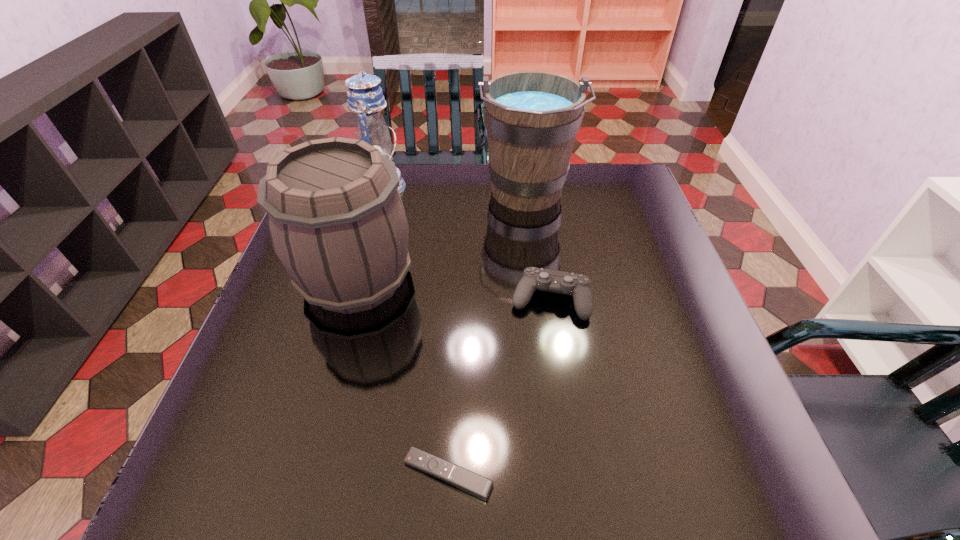
I want to click on free location at the right edge of the desktop, so click(x=669, y=315).

In the image, there is a desktop. Identify the location of vacant space at the far right corner. This screenshot has height=540, width=960. (626, 194).

What are the coordinates of `vacant space at the near right corner of the desktop` in the screenshot? It's located at pyautogui.click(x=688, y=478).

This screenshot has width=960, height=540. What are the coordinates of `free space between the lantern and the farther wine bucket` in the screenshot? It's located at (454, 191).

Identify the location of free area in between the right wine bucket and the remote control. The width and height of the screenshot is (960, 540). (487, 334).

Locate an element on the screen. This screenshot has height=540, width=960. vacant space that is in between the lantern and the right wine bucket is located at coordinates (454, 191).

At what (x,y) coordinates should I click in order to perform the action: click on vacant space that's between the nearest object and the control. Please return your answer as a coordinate pair (x, y). The image size is (960, 540). Looking at the image, I should click on (499, 387).

At what (x,y) coordinates should I click in order to perform the action: click on free spot between the control and the nearer wine bucket. Please return your answer as a coordinate pair (x, y). Looking at the image, I should click on (453, 289).

I want to click on free space between the lantern and the control, so click(x=466, y=243).

Where is `free point between the right wine bucket and the control`? The width and height of the screenshot is (960, 540). free point between the right wine bucket and the control is located at coordinates (539, 247).